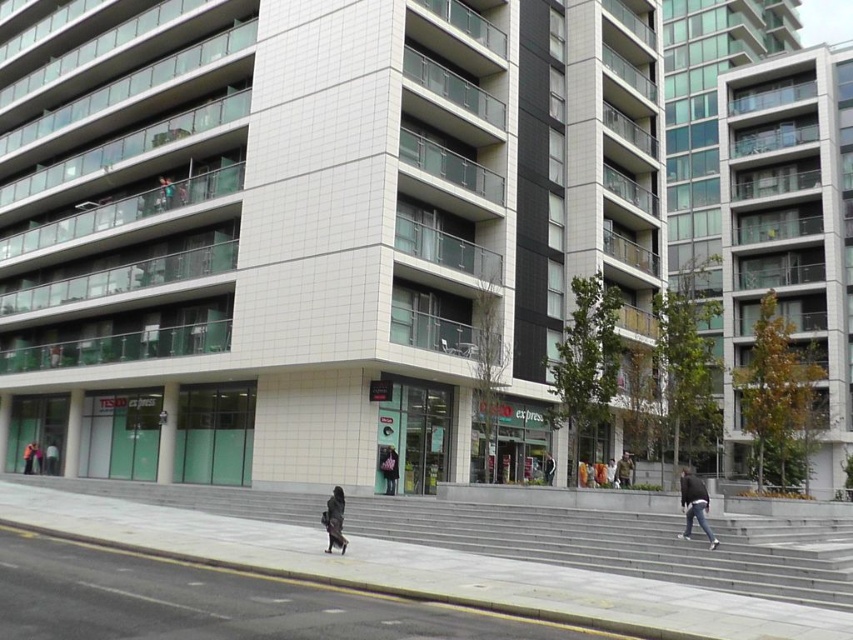
Question: Does dark gray jacket at lower left have a larger size compared to orange fabric bag at lower center?

Choices:
 (A) no
 (B) yes

Answer: (A)

Question: Estimate the real-world distances between objects in this image. Which object is farther from the dark matte coat at center?

Choices:
 (A) dark gray jacket at lower left
 (B) dark gray jacket at center

Answer: (A)

Question: Is gray concrete pavement at lower center below dark gray jacket at lower left?

Choices:
 (A) yes
 (B) no

Answer: (B)

Question: Which of the following is the closest to the observer?

Choices:
 (A) (682, 484)
 (B) (340, 536)
 (C) (42, 577)
 (D) (552, 468)

Answer: (C)

Question: Which point is farther to the camera?

Choices:
 (A) dark matte coat at center
 (B) dark blue jeans at lower right

Answer: (B)

Question: Can you confirm if dark gray jacket at lower left is positioned below dark gray jacket at center?

Choices:
 (A) yes
 (B) no

Answer: (A)